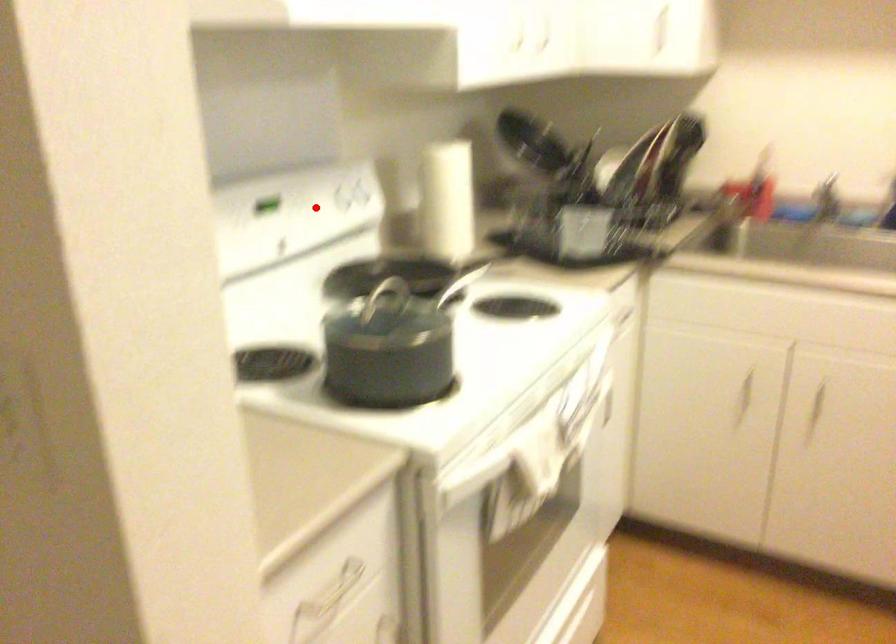
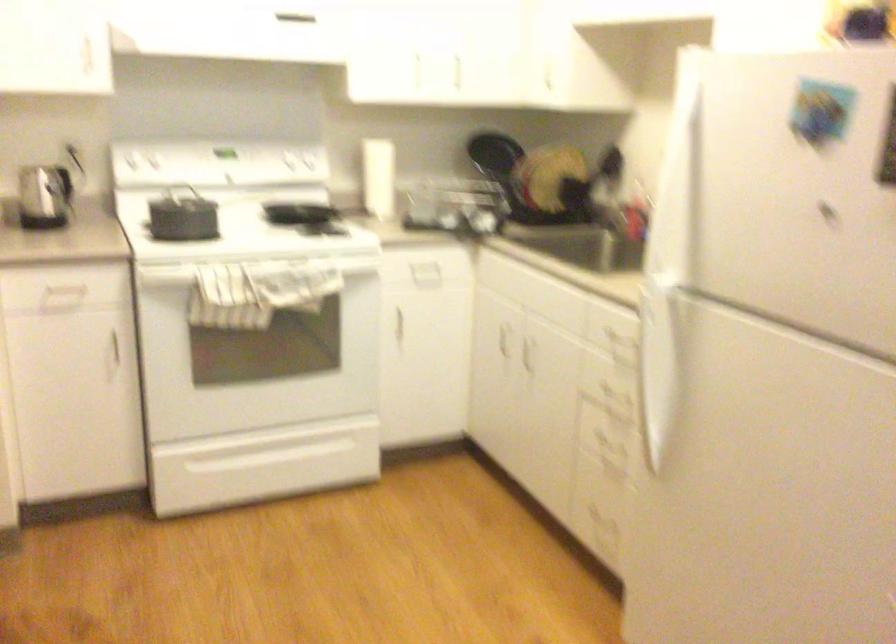
Question: I am providing you with two images of the same scene from different viewpoints. A red point is shown in image1. For the corresponding object point in image2, is it positioned nearer or farther from the camera?

Choices:
 (A) Nearer
 (B) Farther

Answer: (B)